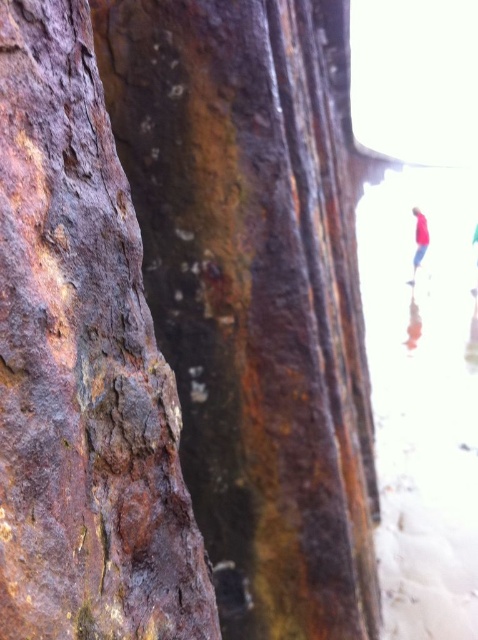
Question: Is rusty metal rock at left to the left of red fabric shirt at upper right from the viewer's perspective?

Choices:
 (A) no
 (B) yes

Answer: (B)

Question: Can you confirm if rusty metal rock at left is positioned above red fabric shirt at upper right?

Choices:
 (A) yes
 (B) no

Answer: (B)

Question: Does rusty metal rock at left appear under red fabric shirt at upper right?

Choices:
 (A) yes
 (B) no

Answer: (A)

Question: Which point is farther to the camera?

Choices:
 (A) (139, 529)
 (B) (415, 257)

Answer: (B)

Question: Which point is closer to the camera?

Choices:
 (A) rusty metal rock at left
 (B) red fabric shirt at upper right

Answer: (A)